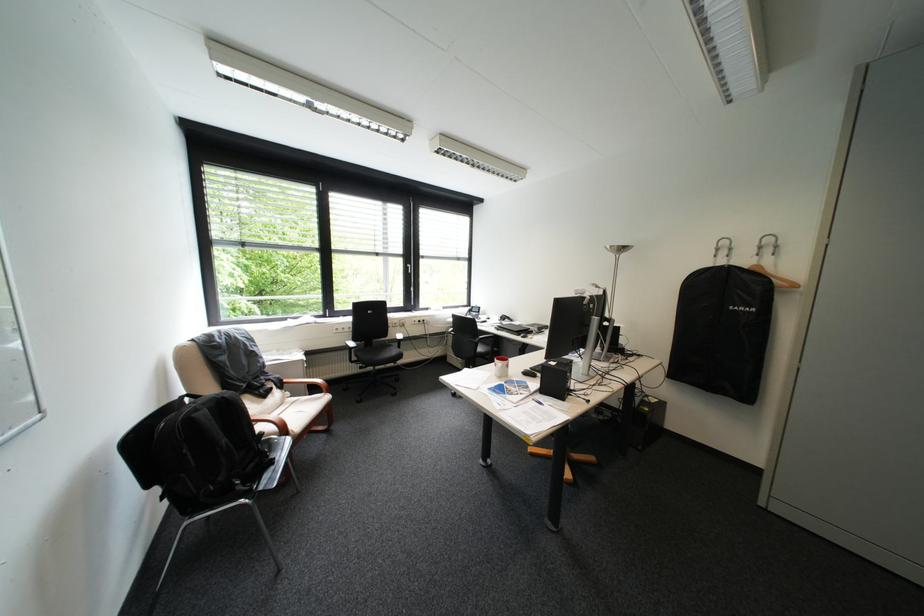
Image resolution: width=924 pixels, height=616 pixels. In order to click on black backpack in this screenshot , I will do `click(208, 448)`.